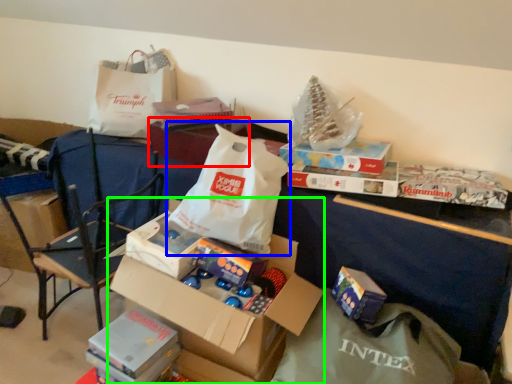
Question: Which is nearer to the storage box (highlighted by a red box)? grocery bag (highlighted by a blue box) or box (highlighted by a green box).

Choices:
 (A) grocery bag
 (B) box

Answer: (A)